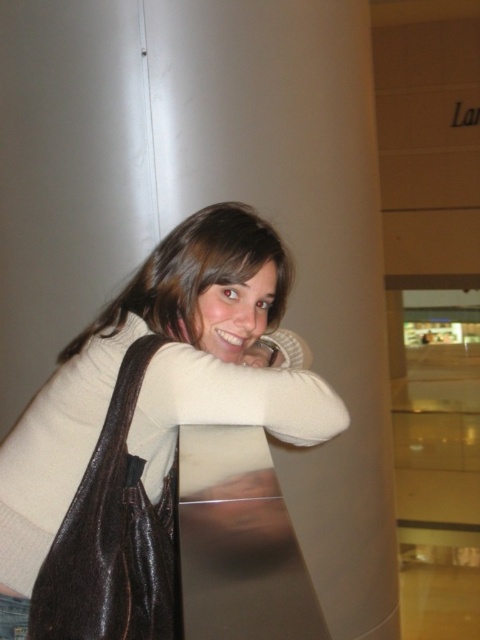
Question: Which point is farther from the camera taking this photo?

Choices:
 (A) (96, 611)
 (B) (219, 282)

Answer: (B)

Question: Does matte brown purse at center appear on the left side of matte beige sweater at center?

Choices:
 (A) yes
 (B) no

Answer: (A)

Question: From the image, what is the correct spatial relationship of matte brown purse at center in relation to matte beige sweater at center?

Choices:
 (A) right
 (B) left

Answer: (B)

Question: Which of the following is the closest to the observer?

Choices:
 (A) denim at left
 (B) matte beige sweater at center

Answer: (A)

Question: Estimate the real-world distances between objects in this image. Which object is closer to the matte beige sweater at center?

Choices:
 (A) denim at left
 (B) matte brown purse at center

Answer: (B)

Question: Is matte brown purse at center to the left of denim at left from the viewer's perspective?

Choices:
 (A) yes
 (B) no

Answer: (B)